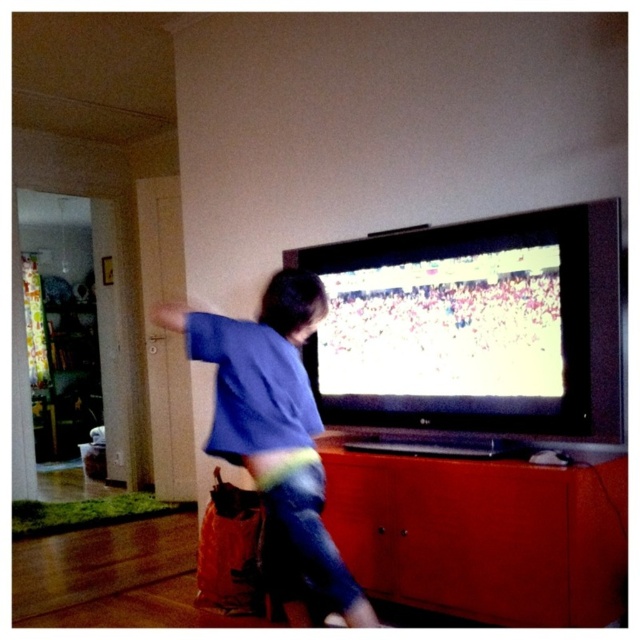
Question: Which point is closer to the camera taking this photo?

Choices:
 (A) (342, 492)
 (B) (240, 456)

Answer: (B)

Question: Which of the following is the farthest from the observer?

Choices:
 (A) (573, 465)
 (B) (262, 358)

Answer: (A)

Question: Can you confirm if matte wood dresser at lower center is bigger than blue cotton shirt at center?

Choices:
 (A) yes
 (B) no

Answer: (A)

Question: Among these points, which one is farthest from the camera?

Choices:
 (A) (465, 464)
 (B) (285, 332)

Answer: (A)

Question: Does matte wood dresser at lower center appear under blue cotton shirt at center?

Choices:
 (A) no
 (B) yes

Answer: (B)

Question: Can you confirm if matte wood dresser at lower center is positioned to the right of blue cotton shirt at center?

Choices:
 (A) yes
 (B) no

Answer: (A)